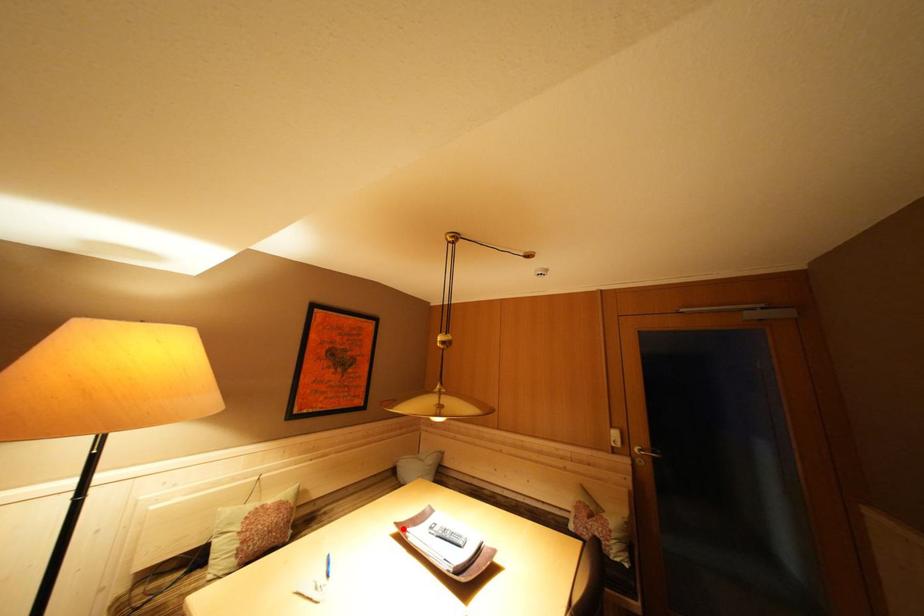
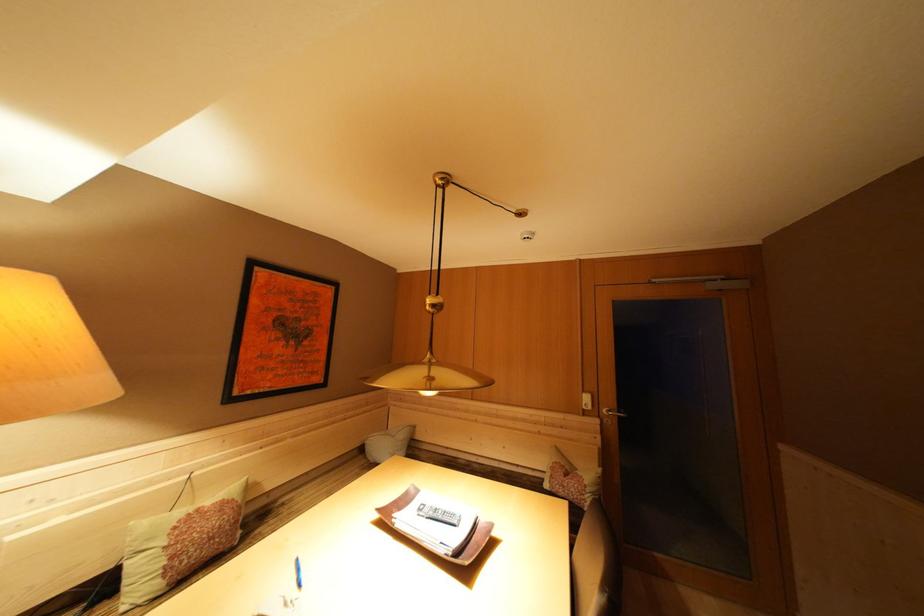
Where in the second image is the point corresponding to the highlighted location from the first image?

(384, 515)